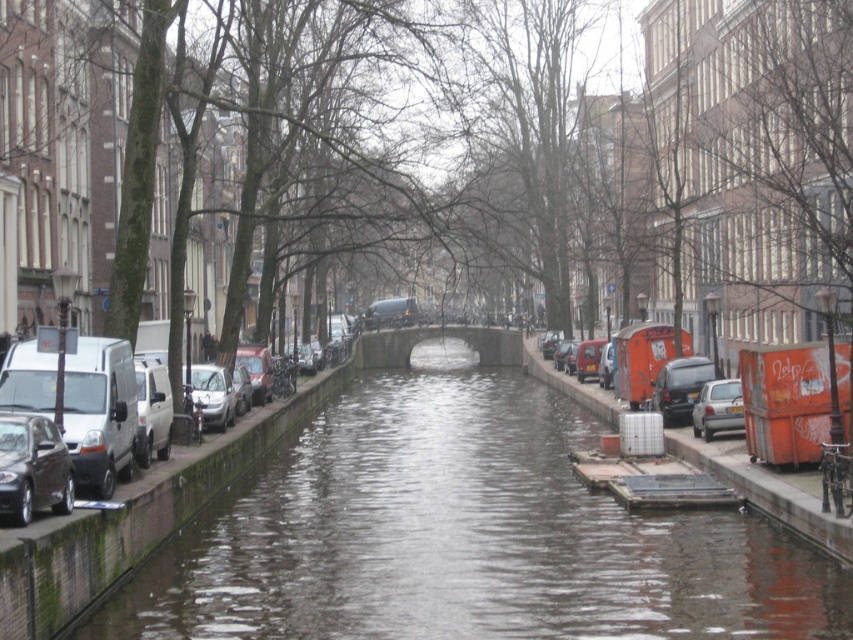
You are a delivery person trying to cross the smooth concrete canal at center with your delivery cart that is 1.8 meters wide. The silver metallic car at center is parked nearby. Can your cart fit across the canal if the car is not blocking the path?

The smooth concrete canal at center is wider than the silver metallic car at center. Since the car is not blocking the path, the delivery cart that is 1.8 meters wide can fit across the canal as its width is greater than the car.